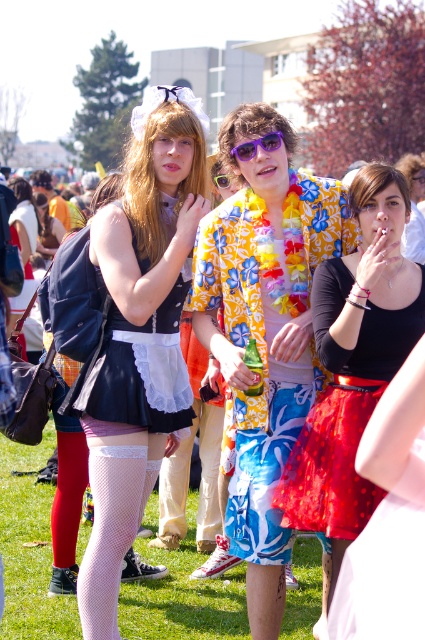
Consider the image. You are taking a photo of the white lace dress at center and the green grass at lower center. Which object will appear larger in the photo?

The white lace dress at center will appear larger in the photo because it is closer to the viewer than the green grass at lower center.